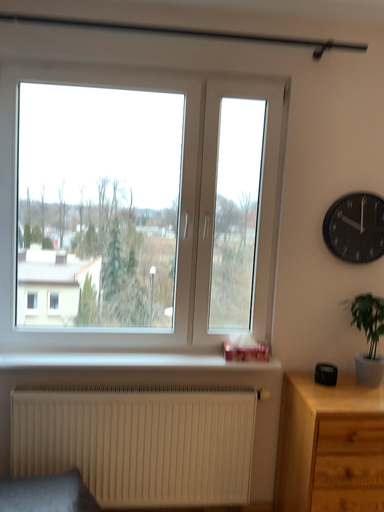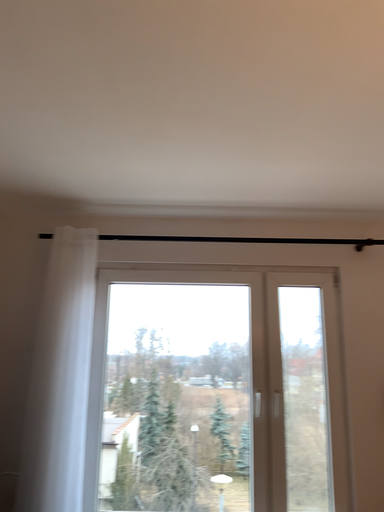
Question: Which way did the camera rotate in the video?

Choices:
 (A) rotated downward
 (B) rotated upward

Answer: (B)